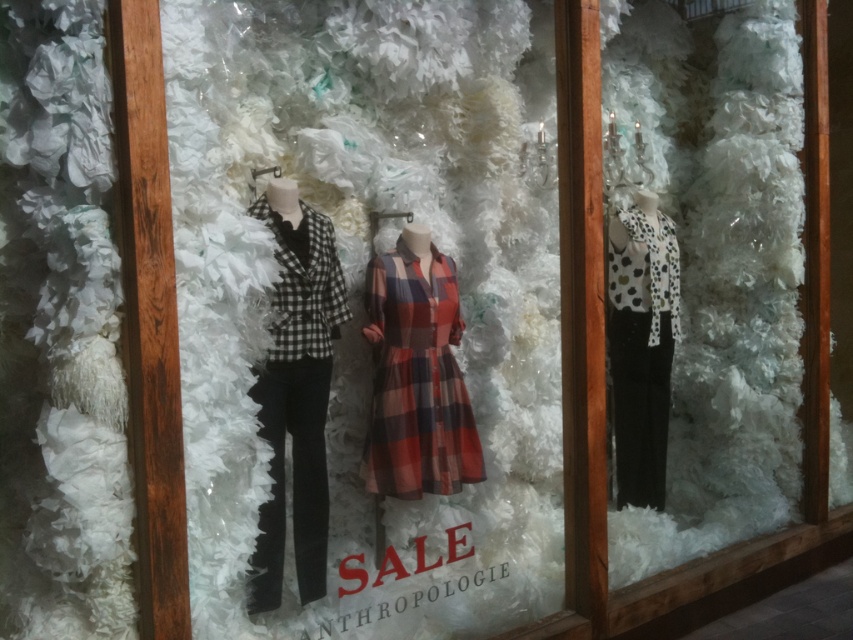
Which is above, plaid cotton dress at center or white dotted fabric top at right?

white dotted fabric top at right is higher up.

The image size is (853, 640). Identify the location of plaid cotton dress at center. (416, 380).

Is point (404, 300) in front of point (621, 218)?

Yes, point (404, 300) is in front of point (621, 218).

Where is `plaid cotton dress at center`? Image resolution: width=853 pixels, height=640 pixels. plaid cotton dress at center is located at coordinates click(416, 380).

Is point (312, 552) positioned after point (664, 227)?

No, (312, 552) is in front of (664, 227).

Between point (283, 518) and point (610, 260), which one is positioned behind?

Point (610, 260)

What are the coordinates of `black checkered blazer at left` in the screenshot? It's located at (296, 392).

Does black checkered blazer at left come in front of plaid cotton dress at center?

That is True.

Does black checkered blazer at left appear under plaid cotton dress at center?

Correct, black checkered blazer at left is located below plaid cotton dress at center.

You are a GUI agent. You are given a task and a screenshot of the screen. Output one action in this format:
    pyautogui.click(x=<x>, y=<y>)
    Task: Click on the black checkered blazer at left
    This screenshot has height=640, width=853.
    Given the screenshot: What is the action you would take?
    pyautogui.click(x=296, y=392)

Find the location of a particular element. The height and width of the screenshot is (640, 853). black checkered blazer at left is located at coordinates (296, 392).